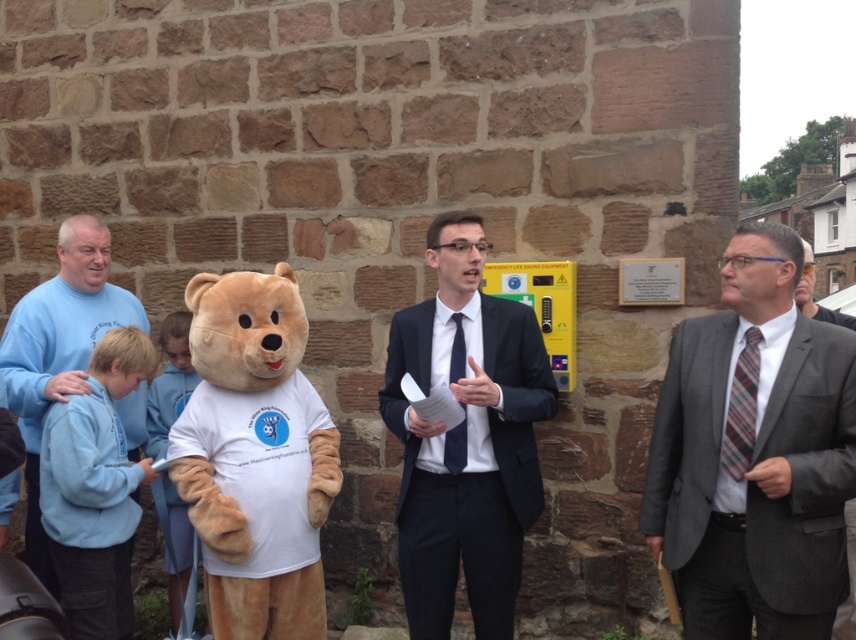
The image size is (856, 640). In order to click on blue cotton shirt at left in this screenshot , I will do `click(58, 352)`.

Can you confirm if blue cotton shirt at left is wider than plaid fabric tie at right?

Yes.

Does point (19, 388) come farther from viewer compared to point (729, 426)?

Yes, it is.

Locate an element on the screen. blue cotton shirt at left is located at coordinates (58, 352).

The height and width of the screenshot is (640, 856). Describe the element at coordinates (254, 456) in the screenshot. I see `fluffy beige teddy bear at center` at that location.

Measure the distance between point (179, 483) and camera.

13.86 feet

Is point (311, 490) positioned in front of point (728, 456)?

No.

Where is `fluffy beige teddy bear at center`? This screenshot has height=640, width=856. fluffy beige teddy bear at center is located at coordinates 254,456.

This screenshot has height=640, width=856. In order to click on fluffy beige teddy bear at center in this screenshot , I will do `click(254, 456)`.

Does fluffy beige teddy bear at center appear on the right side of blue cotton shirt at left?

Indeed, fluffy beige teddy bear at center is positioned on the right side of blue cotton shirt at left.

Find the location of a particular element. fluffy beige teddy bear at center is located at coordinates [254, 456].